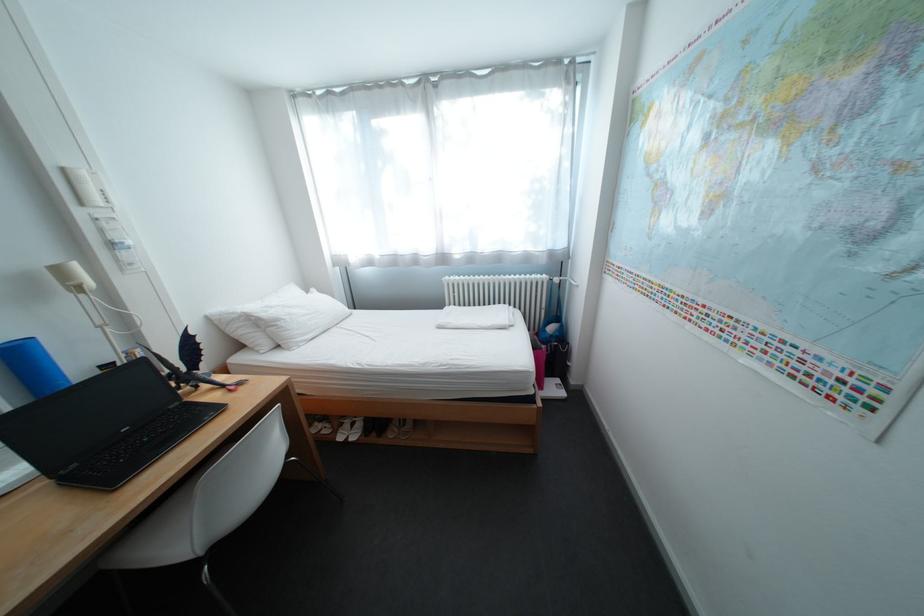
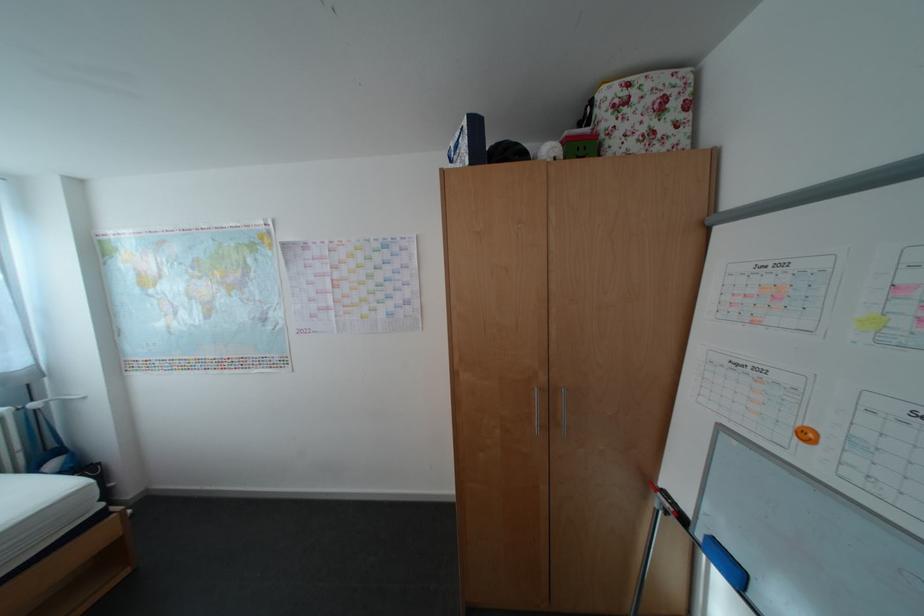
Find the pixel in the second image that matches point (570, 315) in the first image.

(67, 447)